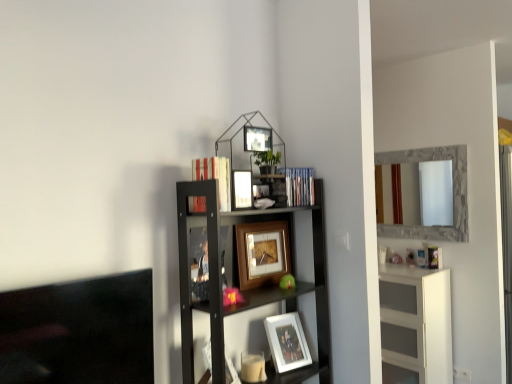
Question: Does wooden picture frame at center, the 2th picture frame positioned from the bottom, have a greater height compared to blue plastic book at upper right, which is counted as the 1th book, starting from the back?

Choices:
 (A) yes
 (B) no

Answer: (A)

Question: Is wooden picture frame at center, which appears as the 3th picture frame when viewed from the top, turned away from blue plastic book at upper right, the 1th book positioned from the right?

Choices:
 (A) no
 (B) yes

Answer: (A)

Question: Can you confirm if wooden picture frame at center, which appears as the 3th picture frame when viewed from the top, is positioned to the right of blue plastic book at upper right, marked as the 2th book in a left-to-right arrangement?

Choices:
 (A) no
 (B) yes

Answer: (A)

Question: Is wooden picture frame at center, the 2th picture frame positioned from the bottom, next to blue plastic book at upper right, which is counted as the 1th book, starting from the back?

Choices:
 (A) yes
 (B) no

Answer: (B)

Question: Can you confirm if wooden picture frame at center, the 2th picture frame positioned from the bottom, is shorter than blue plastic book at upper right, marked as the 2th book in a left-to-right arrangement?

Choices:
 (A) no
 (B) yes

Answer: (A)

Question: Considering the relative sizes of wooden picture frame at center, the 2th picture frame positioned from the bottom, and blue plastic book at upper right, the 1th book positioned from the right, in the image provided, is wooden picture frame at center, the 2th picture frame positioned from the bottom, bigger than blue plastic book at upper right, the 1th book positioned from the right,?

Choices:
 (A) no
 (B) yes

Answer: (B)

Question: Is stone-framed mirror at right bigger than black wood shelf at upper right?

Choices:
 (A) yes
 (B) no

Answer: (B)

Question: Considering the relative positions of stone-framed mirror at right and black wood shelf at upper right in the image provided, is stone-framed mirror at right to the right of black wood shelf at upper right from the viewer's perspective?

Choices:
 (A) no
 (B) yes

Answer: (B)

Question: Does stone-framed mirror at right turn towards black wood shelf at upper right?

Choices:
 (A) no
 (B) yes

Answer: (B)

Question: Considering the relative sizes of stone-framed mirror at right and black wood shelf at upper right in the image provided, is stone-framed mirror at right thinner than black wood shelf at upper right?

Choices:
 (A) no
 (B) yes

Answer: (B)

Question: From a real-world perspective, is stone-framed mirror at right positioned under black wood shelf at upper right based on gravity?

Choices:
 (A) no
 (B) yes

Answer: (A)

Question: Does stone-framed mirror at right come behind black wood shelf at upper right?

Choices:
 (A) yes
 (B) no

Answer: (A)

Question: Can you confirm if blue plastic book at upper right, the 1th book positioned from the right, is taller than hardcover book at upper center, the 2th book in the back-to-front sequence?

Choices:
 (A) no
 (B) yes

Answer: (A)